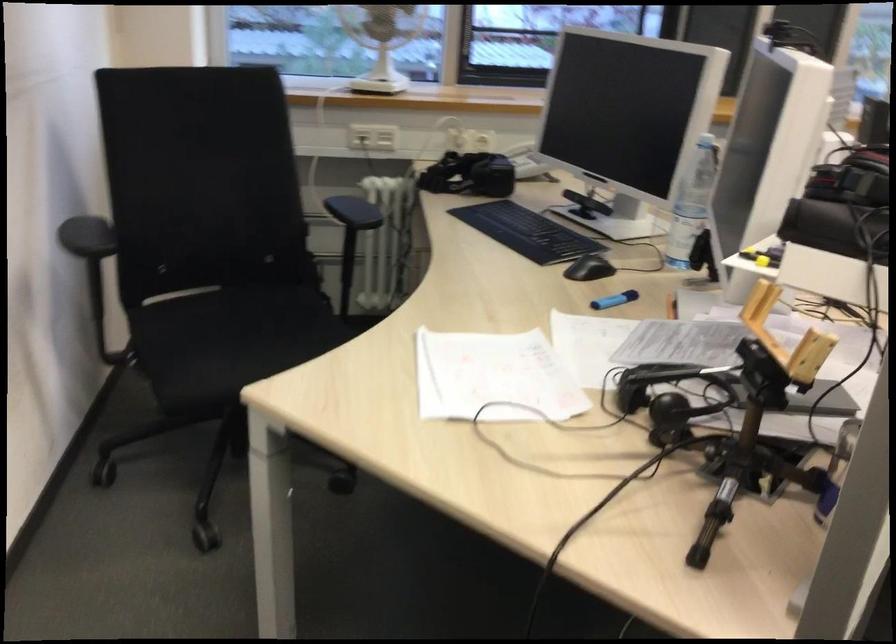
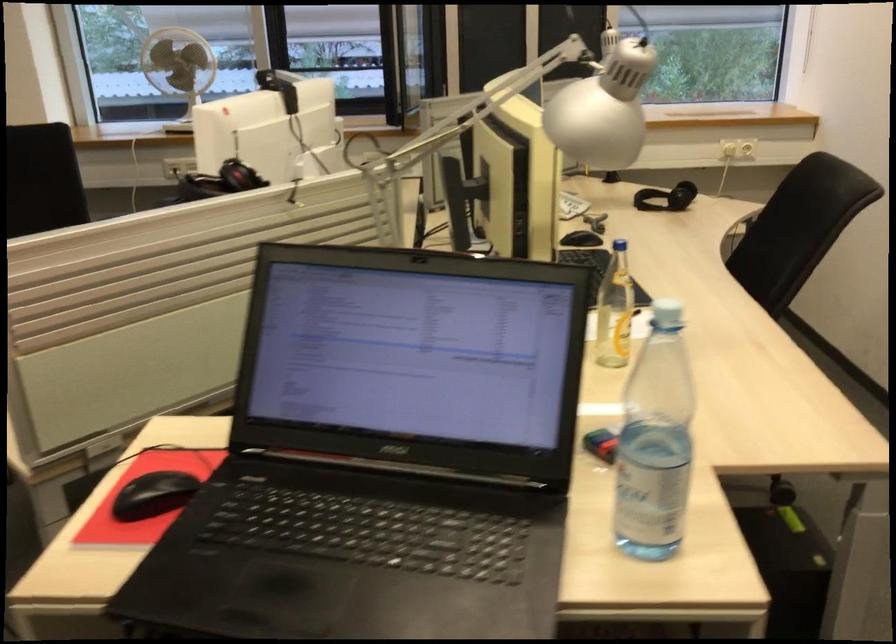
Question: I am providing you with two images of the same scene from different viewpoints. Which of the following objects are not visible in image2?

Choices:
 (A) white desk fan
 (B) white power socket
 (C) small brown cup
 (D) plastic water bottle

Answer: (B)